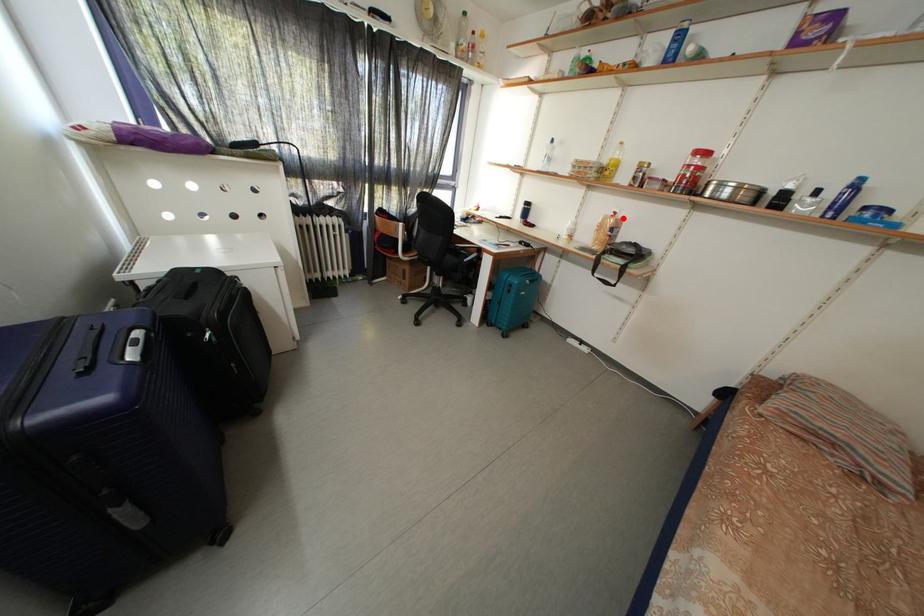
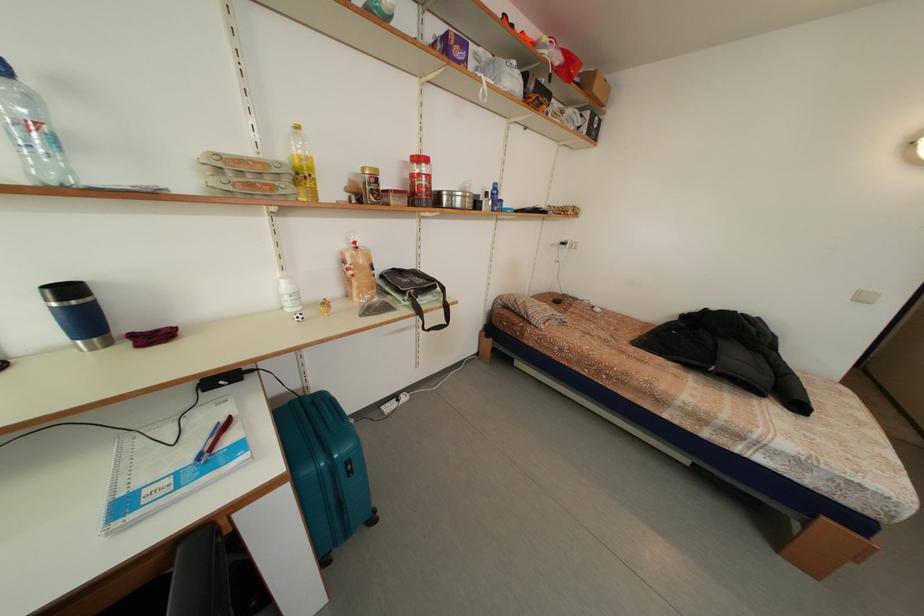
In the second image, find the point that corresponds to the highlighted location in the first image.

(362, 248)